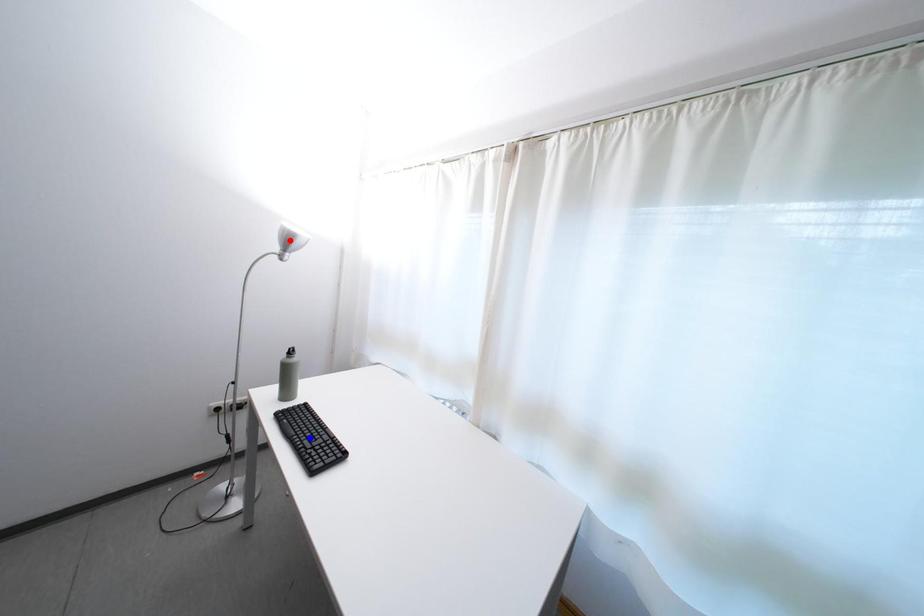
Question: Which of the two points in the image is closer to the camera?

Choices:
 (A) Blue point is closer.
 (B) Red point is closer.

Answer: (A)